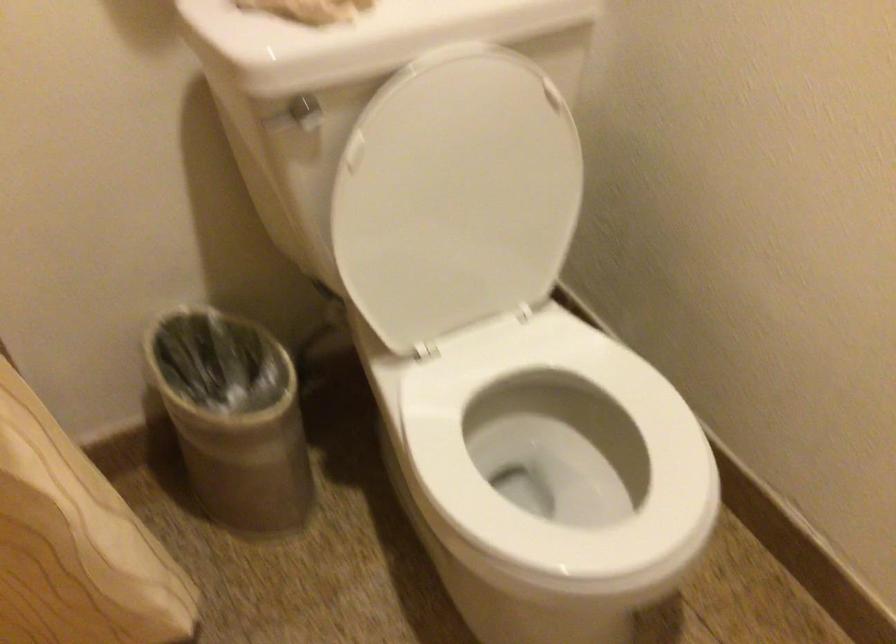
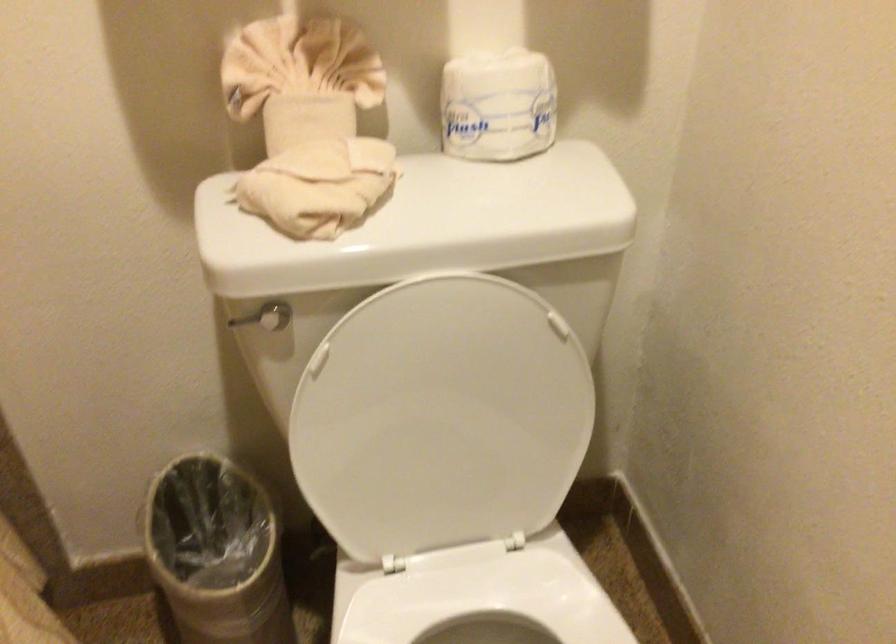
Which direction would the cameraman need to move to produce the second image?

The movement direction of the cameraman is right, forward.